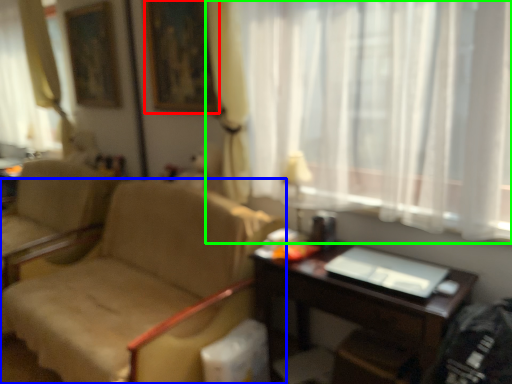
Question: Which is nearer to the picture frame (highlighted by a red box)? chair (highlighted by a blue box) or curtain (highlighted by a green box).

Choices:
 (A) chair
 (B) curtain

Answer: (B)